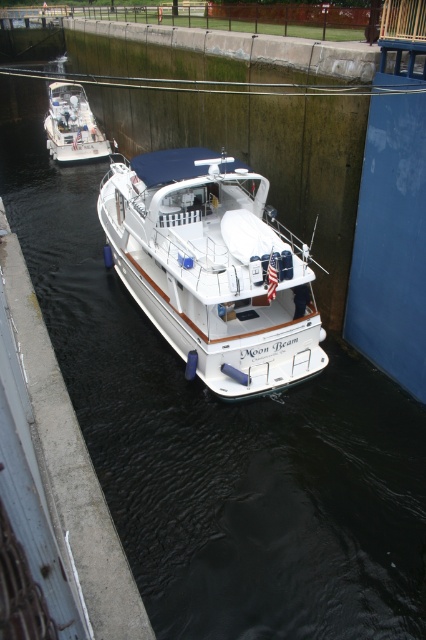
You are a boat operator trying to dock your vessel in the canal lock shown. The docking area is at coordinates point A, which is at position 0.420, 0.502. Can you dock your boat at the white glossy boat at center without moving it?

The white glossy boat at center is located at point A, so you can dock your boat there without moving it.

You are a photographer positioned at the edge of the canal lock. You need to capture both the white glossy boat at center and the white glossy boat at upper left in a single shot. Based on their positions, which boat should you adjust your camera angle to include first?

The white glossy boat at upper left should be included first because the white glossy boat at center is to the right of it, so adjusting the angle to the left first would ensure both are in frame.

You are standing at the point labeled point (x=268, y=381) and want to throw a ball to your friend standing at point (x=57, y=99). Considering the canal lock layout, will the ball need to travel upward or downward to reach your friend?

The ball will need to travel downward because point (x=57, y=99) is farther from the camera than point (x=268, y=381), so your friend is located at a lower position in the canal lock.